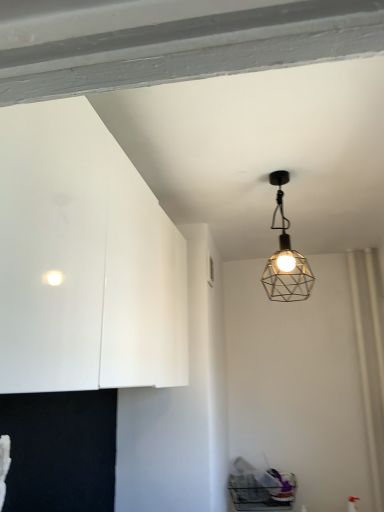
Question: Looking at the image, does white glossy cabinet at left seem bigger or smaller compared to metallic wireframe lamp at upper center?

Choices:
 (A) small
 (B) big

Answer: (B)

Question: Considering the relative positions of white glossy cabinet at left and metallic wireframe lamp at upper center in the image provided, is white glossy cabinet at left to the left or to the right of metallic wireframe lamp at upper center?

Choices:
 (A) right
 (B) left

Answer: (B)

Question: Considering the positions of white glossy cabinet at left and metallic wireframe lamp at upper center in the image, is white glossy cabinet at left taller or shorter than metallic wireframe lamp at upper center?

Choices:
 (A) tall
 (B) short

Answer: (A)

Question: Looking at their shapes, would you say metallic wireframe lamp at upper center is wider or thinner than white glossy cabinet at left?

Choices:
 (A) wide
 (B) thin

Answer: (B)

Question: From a real-world perspective, relative to white glossy cabinet at left, is metallic wireframe lamp at upper center vertically above or below?

Choices:
 (A) above
 (B) below

Answer: (A)

Question: Based on their sizes in the image, would you say metallic wireframe lamp at upper center is bigger or smaller than white glossy cabinet at left?

Choices:
 (A) big
 (B) small

Answer: (B)

Question: From their relative heights in the image, would you say metallic wireframe lamp at upper center is taller or shorter than white glossy cabinet at left?

Choices:
 (A) short
 (B) tall

Answer: (A)